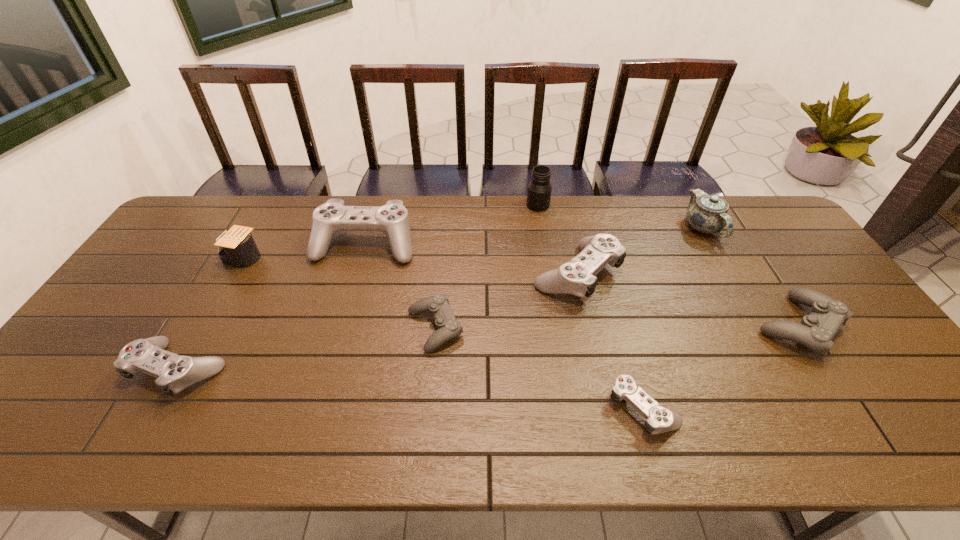
Locate an element on the screen. Image resolution: width=960 pixels, height=540 pixels. the smaller gray control is located at coordinates (448, 327).

This screenshot has width=960, height=540. In order to click on the third control from left to right in this screenshot , I will do `click(448, 327)`.

Where is `the smallest white control`? The width and height of the screenshot is (960, 540). the smallest white control is located at coordinates (659, 419).

Identify the location of vacant space located 0.340m on the right of the jar. The image size is (960, 540). (645, 205).

The image size is (960, 540). What are the coordinates of `vacant space located 0.220m from the spout of the chinaware` in the screenshot? It's located at (742, 298).

This screenshot has height=540, width=960. Identify the location of free space located on the front of the tallest control. (330, 367).

Where is `vacant space located on the left of the fifth shortest control`? The image size is (960, 540). vacant space located on the left of the fifth shortest control is located at coordinates (479, 274).

Identify the location of free space located on the back of the calculator. The image size is (960, 540). (260, 225).

Identify the location of free space located on the left of the rightmost control. [x=732, y=326].

What are the coordinates of `free spot located on the left of the leftmost control` in the screenshot? It's located at (67, 370).